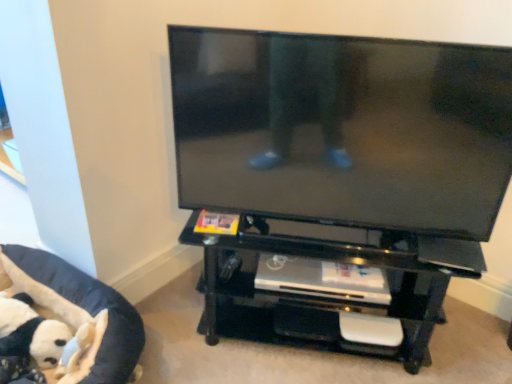
Question: Considering the positions of point (139, 327) and point (385, 251), is point (139, 327) closer or farther from the camera than point (385, 251)?

Choices:
 (A) farther
 (B) closer

Answer: (A)

Question: Considering the positions of black fabric pet bed at lower left and black glossy entertainment center at center in the image, is black fabric pet bed at lower left taller or shorter than black glossy entertainment center at center?

Choices:
 (A) tall
 (B) short

Answer: (B)

Question: Based on their relative distances, which object is nearer to the black glossy entertainment center at center?

Choices:
 (A) black glossy flat-screen tv at center
 (B) black fabric pet bed at lower left

Answer: (A)

Question: Estimate the real-world distances between objects in this image. Which object is closer to the black fabric pet bed at lower left?

Choices:
 (A) black glossy entertainment center at center
 (B) black glossy flat-screen tv at center

Answer: (A)